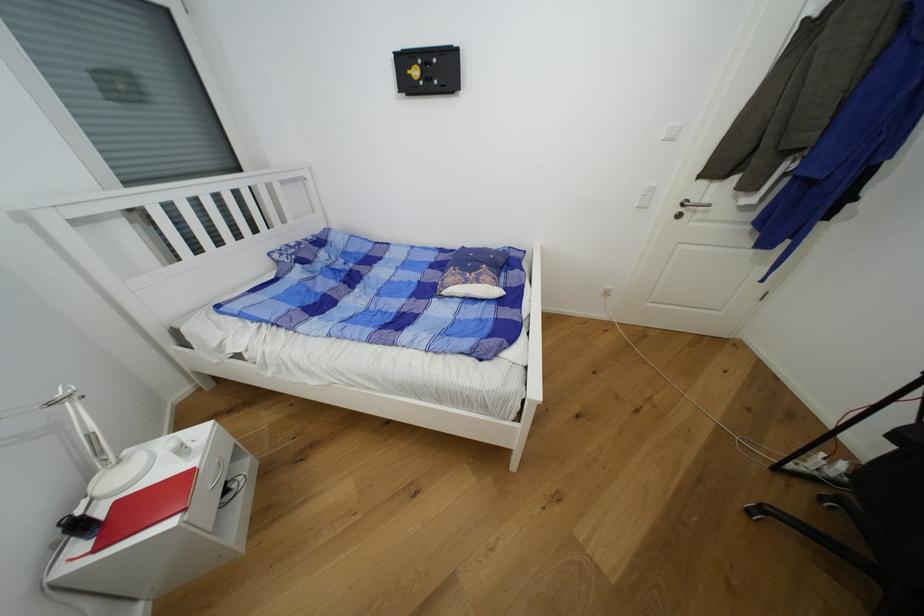
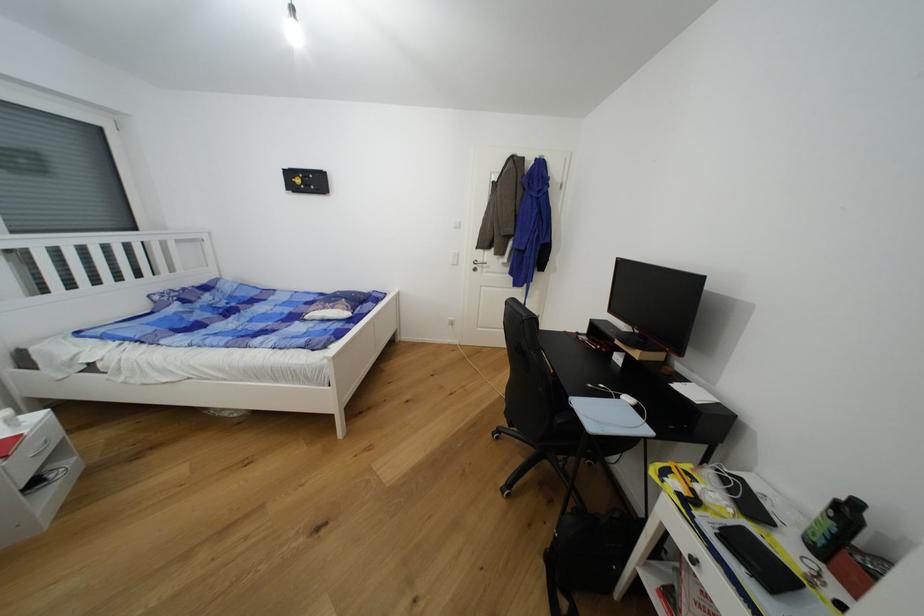
Find the pixel in the second image that matches pixel 482 283 in the first image.

(337, 310)